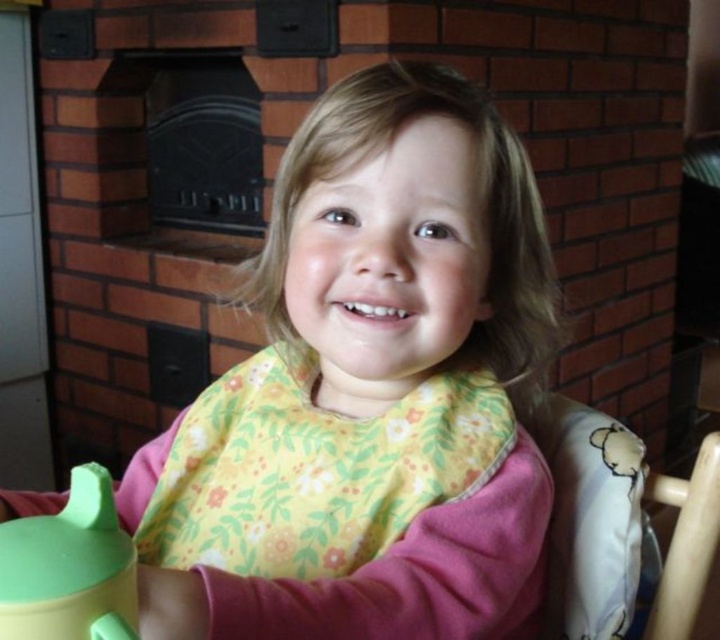
You are a parent trying to place a small toy between the wooden chair at right and the green rubber tea pot at lower left. Based on their positions, which object is closer to you so the toy can be placed in between them?

The wooden chair at right is closer to you than the green rubber tea pot at lower left, so placing the toy between them would require positioning it near the wooden chair at right first.